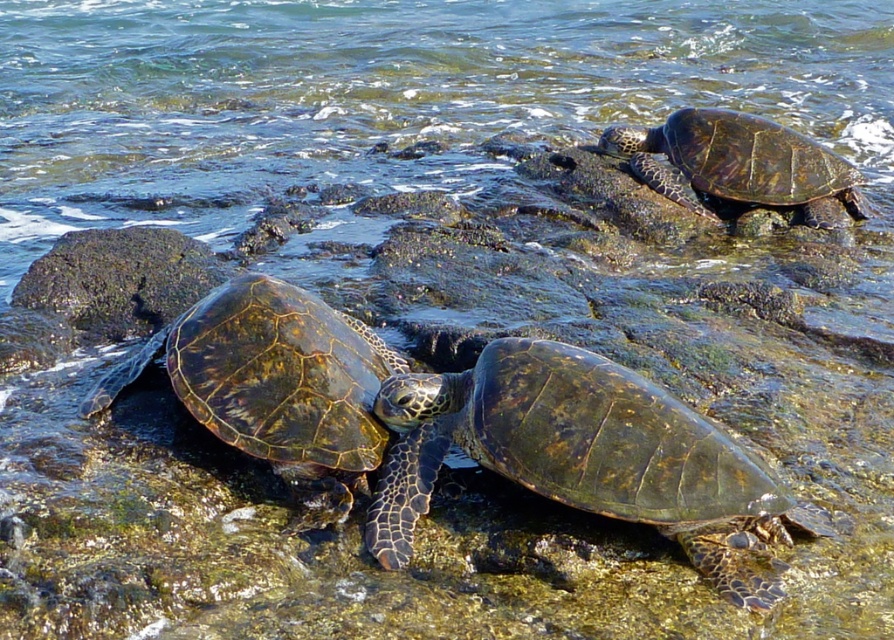
Between point (580, 460) and point (399, 554), which one is positioned in front?

Point (399, 554)

Does shiny dark green tortoise at center have a greater width compared to leathery green turtle at center?

Indeed, shiny dark green tortoise at center has a greater width compared to leathery green turtle at center.

At what (x,y) coordinates should I click in order to perform the action: click on shiny dark green tortoise at center. Please return your answer as a coordinate pair (x, y). This screenshot has width=894, height=640. Looking at the image, I should click on (587, 458).

Is the position of leathery green turtle at center less distant than that of leathery greenish-brown turtle at upper right?

Yes.

Can you confirm if leathery green turtle at center is bigger than leathery greenish-brown turtle at upper right?

Correct, leathery green turtle at center is larger in size than leathery greenish-brown turtle at upper right.

Between point (385, 362) and point (644, 172), which one is positioned in front?

Point (385, 362) is more forward.

This screenshot has width=894, height=640. Find the location of `leathery green turtle at center`. leathery green turtle at center is located at coordinates (296, 400).

In the scene shown: Does leathery green turtle at center have a larger size compared to green mossy rock at left?

Indeed, leathery green turtle at center has a larger size compared to green mossy rock at left.

Does leathery green turtle at center appear on the right side of green mossy rock at left?

Yes, leathery green turtle at center is to the right of green mossy rock at left.

Is point (275, 296) positioned behind point (102, 324)?

No, it is in front of (102, 324).

At what (x,y) coordinates should I click in order to perform the action: click on leathery green turtle at center. Please return your answer as a coordinate pair (x, y). The height and width of the screenshot is (640, 894). Looking at the image, I should click on (296, 400).